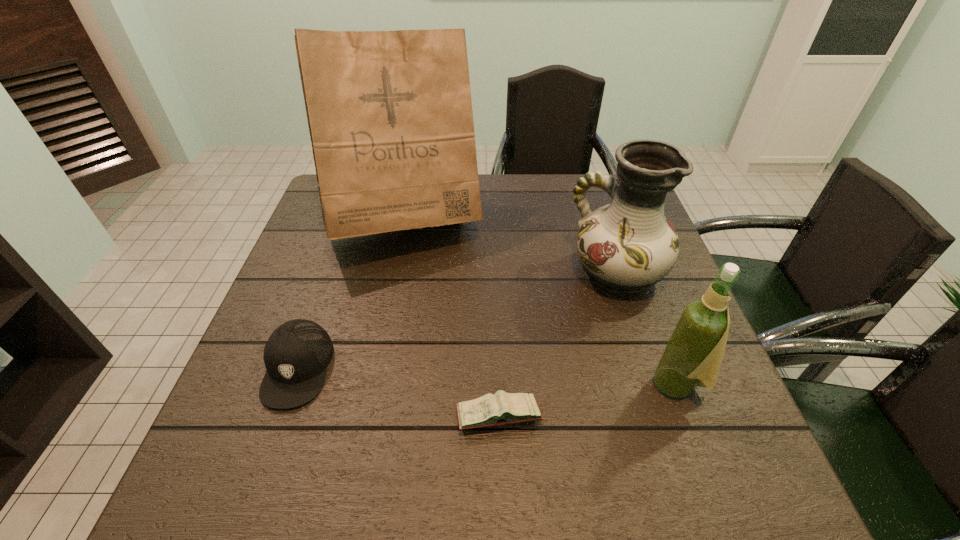
In the image, there is a desktop. What are the coordinates of `vacant space at the left edge` in the screenshot? It's located at (303, 254).

Image resolution: width=960 pixels, height=540 pixels. Find the location of `vacant area that lies between the cap and the shortest object`. vacant area that lies between the cap and the shortest object is located at coordinates (398, 392).

Find the location of a particular element. This screenshot has height=540, width=960. unoccupied position between the wine bottle and the shortest object is located at coordinates (588, 400).

Identify the location of vacant space that's between the shortest object and the wine bottle. The width and height of the screenshot is (960, 540). (588, 400).

I want to click on free spot between the vase and the tallest object, so click(x=511, y=249).

The width and height of the screenshot is (960, 540). Identify the location of blank region between the tallest object and the wine bottle. (541, 305).

In order to click on vacant area between the cap and the diary in this screenshot , I will do point(398,392).

Find the location of a particular element. vacant area that lies between the wine bottle and the diary is located at coordinates 588,400.

You are a GUI agent. You are given a task and a screenshot of the screen. Output one action in this format:
    pyautogui.click(x=<x>, y=<y>)
    Task: Click on the vacant space that's between the second shortest object and the vase
    Image resolution: width=960 pixels, height=540 pixels.
    Given the screenshot: What is the action you would take?
    pyautogui.click(x=457, y=320)

Find the location of `vacant region between the wine bottle and the vase`. vacant region between the wine bottle and the vase is located at coordinates (647, 328).